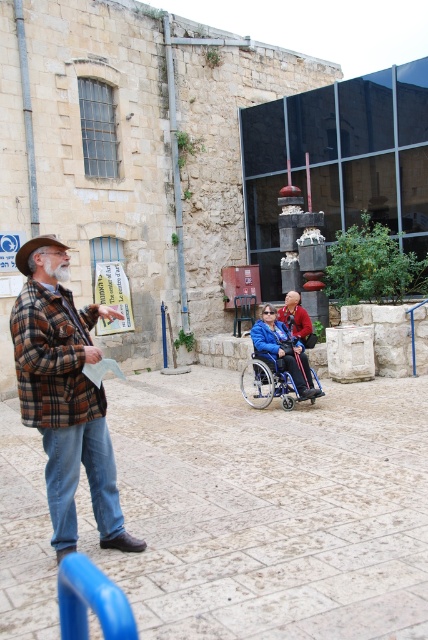
What is the 2D coordinate of the plaid wool jacket at center?

The plaid wool jacket at center is located at the 2D coordinate point of (65, 394).

You are a tour guide leading a group in the courtyard. You need to ensure accessibility for a guest in a wheelchair. The blue plastic wheelchair at center and the red fabric jacket at center are both in the way of the path to the blue railing. Which object should you move first to clear the path?

The blue plastic wheelchair at center is taller than the red fabric jacket at center, so you should move the blue plastic wheelchair at center first to clear the path.